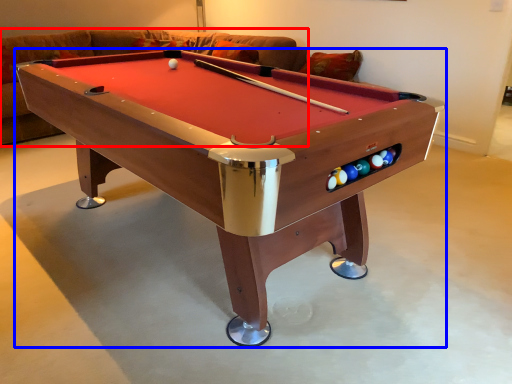
Question: Among these objects, which one is nearest to the camera, couch (highlighted by a red box) or billiard table (highlighted by a blue box)?

Choices:
 (A) couch
 (B) billiard table

Answer: (B)